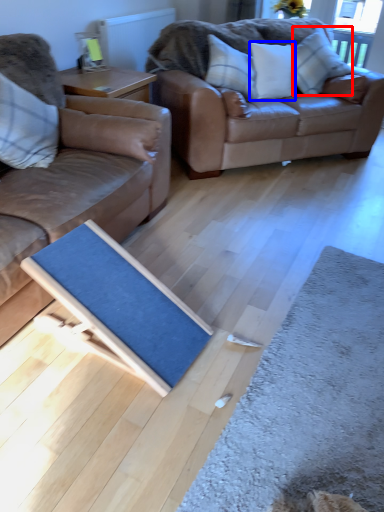
Question: Which point is closer to the camera, pillow (highlighted by a red box) or pillow (highlighted by a blue box)?

Choices:
 (A) pillow
 (B) pillow

Answer: (B)